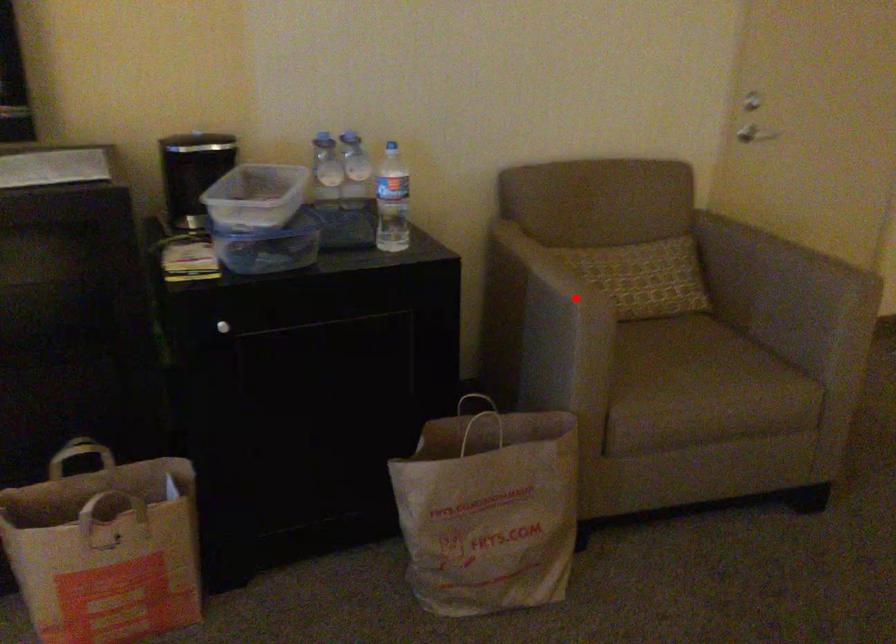
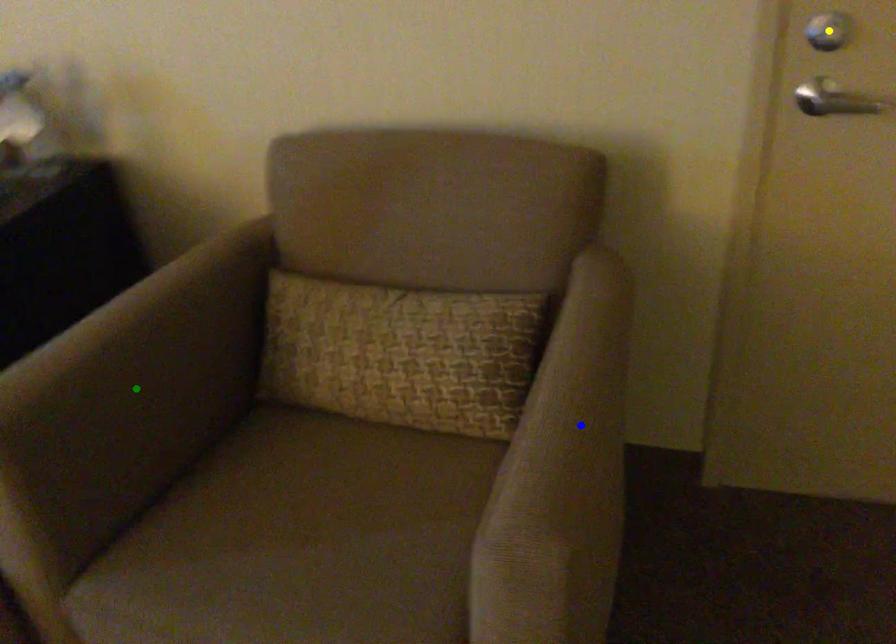
Question: I am providing you with two images of the same scene from different viewpoints. A red point is marked on the first image. You are given multiple points on the second image. Which point in image 2 represents the same 3d spot as the red point in image 1?

Choices:
 (A) blue point
 (B) yellow point
 (C) green point

Answer: (C)